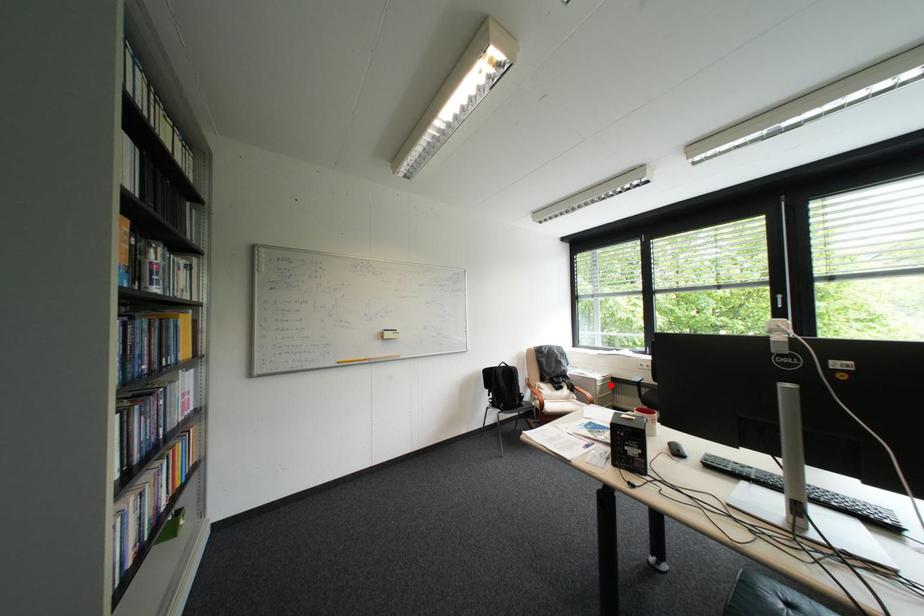
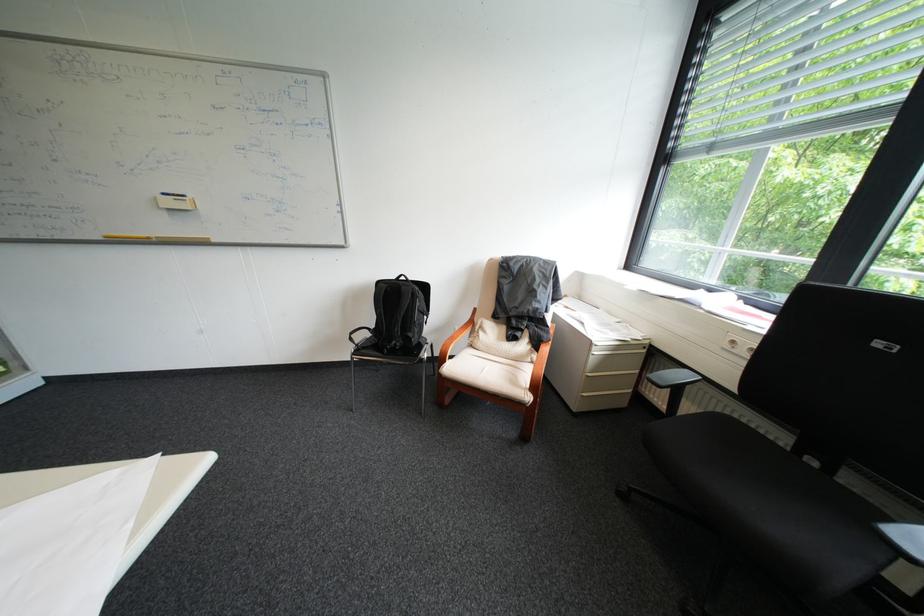
Where in the second image is the point corresponding to the highlighted location from the first image?

(609, 353)